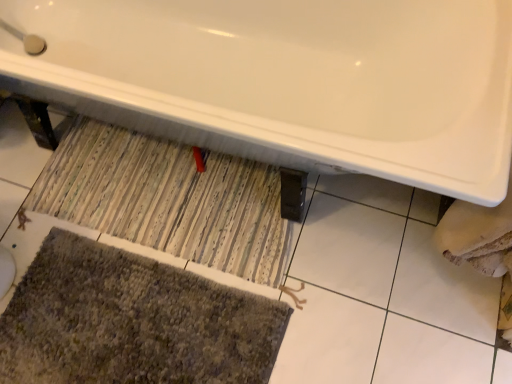
At what (x,y) coordinates should I click in order to perform the action: click on blank space above striped fabric doormat at center (from a real-world perspective). Please return your answer as a coordinate pair (x, y). This screenshot has height=384, width=512. Looking at the image, I should click on (177, 193).